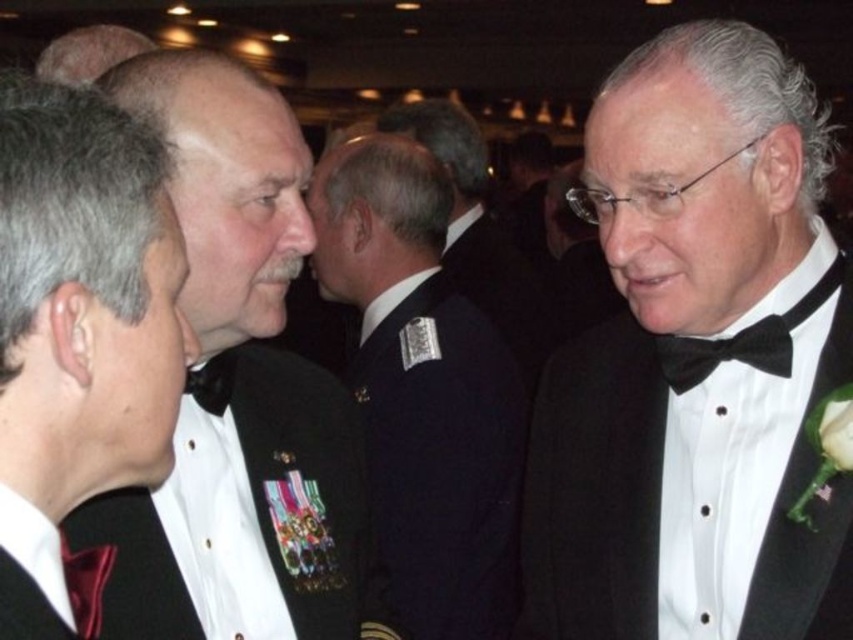
Question: Which object is closer to the camera taking this photo?

Choices:
 (A) shiny black fabric at center
 (B) navy blue fabric at center
 (C) black satin bow tie at right

Answer: (A)

Question: Which point is closer to the camera taking this photo?

Choices:
 (A) (207, 608)
 (B) (86, 378)
 (C) (415, 522)
 (D) (672, 154)

Answer: (B)

Question: Which of the following is the closest to the observer?

Choices:
 (A) (521, 545)
 (B) (157, 552)
 (C) (142, 492)

Answer: (B)

Question: Does shiny black fabric at center have a larger size compared to black satin uniform at center?

Choices:
 (A) no
 (B) yes

Answer: (A)

Question: Is black satin tuxedo at right below black satin bow tie at right?

Choices:
 (A) no
 (B) yes

Answer: (B)

Question: Can you confirm if black satin tuxedo at right is bigger than black satin bow tie at right?

Choices:
 (A) no
 (B) yes

Answer: (B)